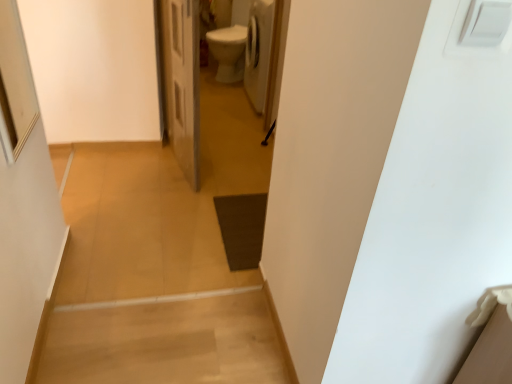
Question: Is white plastic switch at upper right thinner than white glossy door at center?

Choices:
 (A) no
 (B) yes

Answer: (B)

Question: Is the position of white plastic switch at upper right more distant than that of white glossy door at center?

Choices:
 (A) no
 (B) yes

Answer: (A)

Question: Would you say white plastic switch at upper right is a long distance from white glossy door at center?

Choices:
 (A) no
 (B) yes

Answer: (B)

Question: Is the depth of white plastic switch at upper right less than that of white glossy door at center?

Choices:
 (A) no
 (B) yes

Answer: (B)

Question: Considering the relative sizes of white plastic switch at upper right and white glossy door at center in the image provided, is white plastic switch at upper right shorter than white glossy door at center?

Choices:
 (A) no
 (B) yes

Answer: (B)

Question: Could you tell me if white plastic switch at upper right is turned towards white glossy door at center?

Choices:
 (A) yes
 (B) no

Answer: (B)

Question: Is white glossy door at center wider than white plastic switch at upper right?

Choices:
 (A) no
 (B) yes

Answer: (B)

Question: From the image's perspective, does white glossy door at center appear lower than white plastic switch at upper right?

Choices:
 (A) no
 (B) yes

Answer: (A)

Question: From a real-world perspective, is white glossy door at center under white plastic switch at upper right?

Choices:
 (A) no
 (B) yes

Answer: (B)

Question: Does white glossy door at center appear on the left side of white plastic switch at upper right?

Choices:
 (A) no
 (B) yes

Answer: (B)

Question: Can you confirm if white glossy door at center is thinner than white plastic switch at upper right?

Choices:
 (A) no
 (B) yes

Answer: (A)

Question: Considering the relative sizes of white glossy door at center and white plastic switch at upper right in the image provided, is white glossy door at center smaller than white plastic switch at upper right?

Choices:
 (A) no
 (B) yes

Answer: (A)

Question: From the image's perspective, is white plastic switch at upper right located above or below white glossy door at center?

Choices:
 (A) above
 (B) below

Answer: (B)